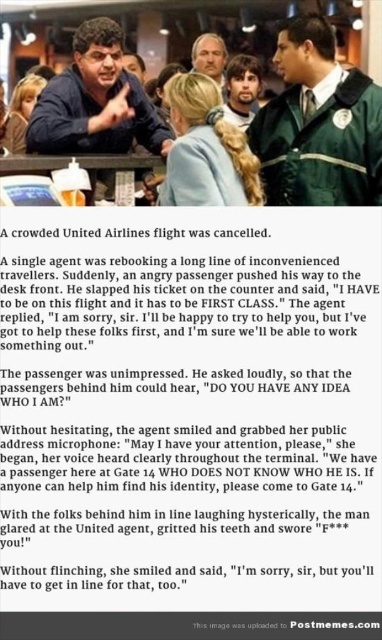
Question: Estimate the real-world distances between objects in this image. Which object is closer to the matte black shirt at left?

Choices:
 (A) smooth brown hair at center
 (B) black paper at center

Answer: (B)

Question: Which point is closer to the camera?

Choices:
 (A) green uniform at center
 (B) dark brown hair at center
 (C) matte black shirt at left
 (D) smooth brown hair at center

Answer: (A)

Question: Which of the following is the farthest from the observer?

Choices:
 (A) black paper at center
 (B) matte black shirt at left
 (C) smooth brown hair at center

Answer: (C)

Question: Can you confirm if black paper at center is positioned to the left of green uniform at center?

Choices:
 (A) yes
 (B) no

Answer: (A)

Question: Where is black paper at center located in relation to smooth brown hair at center in the image?

Choices:
 (A) above
 (B) below

Answer: (B)

Question: Is green uniform at center below matte black shirt at left?

Choices:
 (A) no
 (B) yes

Answer: (B)